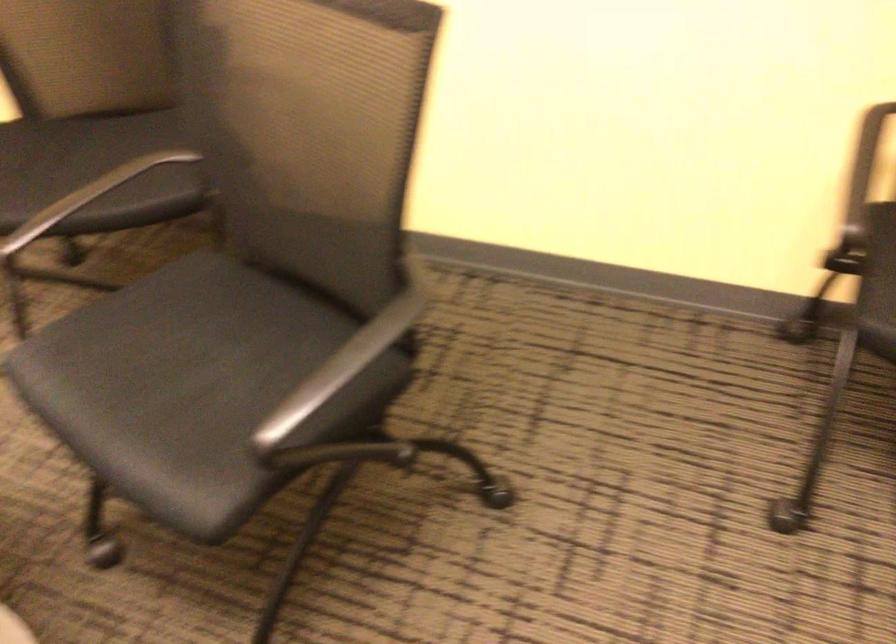
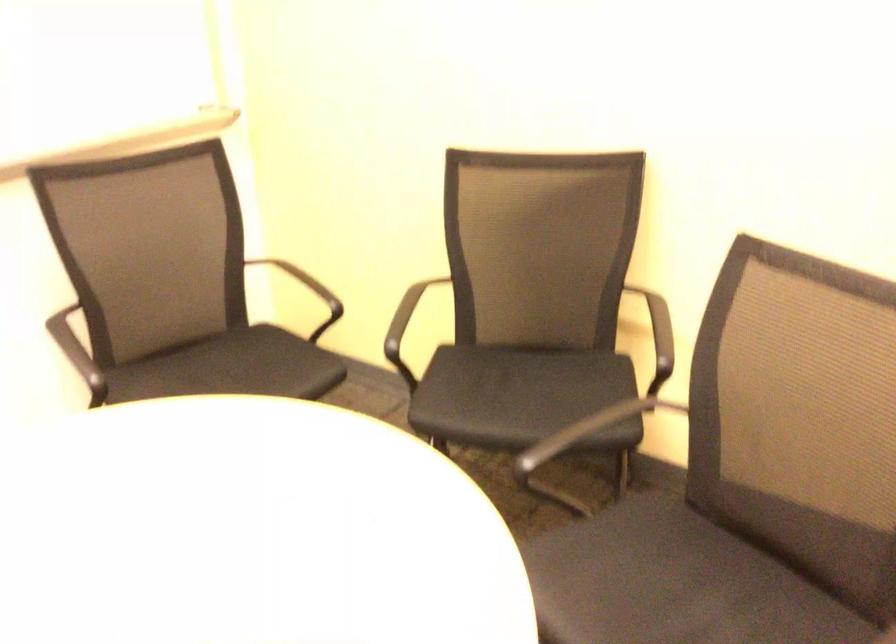
What movement of the cameraman would produce the second image?

The cameraman walked toward left, backward.